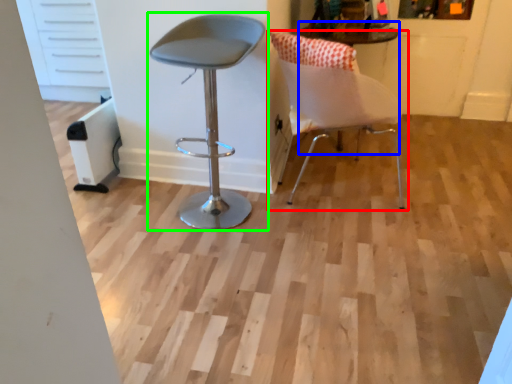
Question: Which object is positioned farthest from chair (highlighted by a red box)? Select from round table (highlighted by a blue box) and chair (highlighted by a green box).

Choices:
 (A) round table
 (B) chair

Answer: (A)